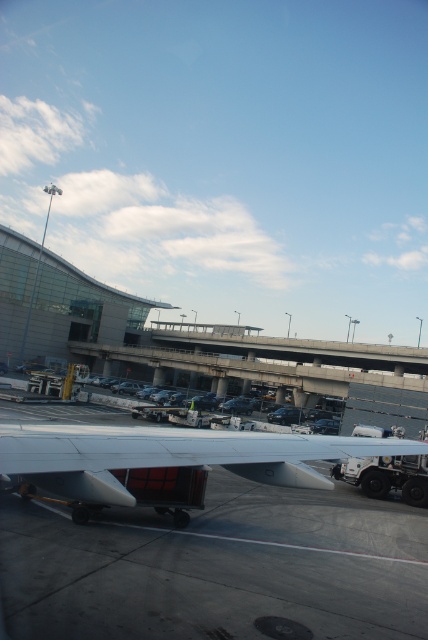
Question: Can you confirm if gray concrete tarmac at lower center is positioned above silver metallic wing at center?

Choices:
 (A) yes
 (B) no

Answer: (B)

Question: Can you confirm if gray concrete tarmac at lower center is positioned to the right of silver metallic wing at center?

Choices:
 (A) yes
 (B) no

Answer: (A)

Question: Is gray concrete tarmac at lower center thinner than silver metallic wing at center?

Choices:
 (A) yes
 (B) no

Answer: (B)

Question: Which point is farther to the camera?

Choices:
 (A) silver metallic wing at center
 (B) gray concrete tarmac at lower center

Answer: (B)